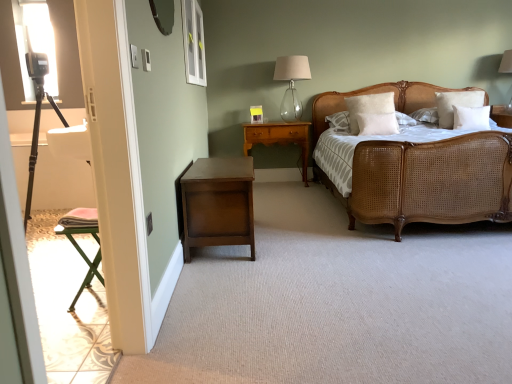
Question: Does white soft pillow at upper right, which is the fourth pillow from left to right, appear on the right side of woven cane bed at center?

Choices:
 (A) yes
 (B) no

Answer: (A)

Question: Can you confirm if white soft pillow at upper right, which is the fourth pillow from left to right, is thinner than woven cane bed at center?

Choices:
 (A) no
 (B) yes

Answer: (B)

Question: Does white soft pillow at upper right, the first pillow in the right-to-left sequence, have a greater width compared to woven cane bed at center?

Choices:
 (A) yes
 (B) no

Answer: (B)

Question: Does white soft pillow at upper right, the first pillow in the right-to-left sequence, come in front of woven cane bed at center?

Choices:
 (A) yes
 (B) no

Answer: (B)

Question: Is white soft pillow at upper right, the first pillow in the right-to-left sequence, taller than woven cane bed at center?

Choices:
 (A) yes
 (B) no

Answer: (B)

Question: Is white soft pillow at upper right, which is the fourth pillow from left to right, smaller than woven cane bed at center?

Choices:
 (A) yes
 (B) no

Answer: (A)

Question: Is dark wood nightstand at lower left, marked as the first nightstand in a front-to-back arrangement, with wooden nightstand at center, marked as the second nightstand in a front-to-back arrangement?

Choices:
 (A) yes
 (B) no

Answer: (B)

Question: Can you confirm if dark wood nightstand at lower left, the second nightstand positioned from the back, is bigger than wooden nightstand at center, the first nightstand positioned from the back?

Choices:
 (A) yes
 (B) no

Answer: (A)

Question: Can we say dark wood nightstand at lower left, marked as the first nightstand in a front-to-back arrangement, lies outside wooden nightstand at center, marked as the second nightstand in a front-to-back arrangement?

Choices:
 (A) yes
 (B) no

Answer: (A)

Question: Is dark wood nightstand at lower left, the second nightstand positioned from the back, smaller than wooden nightstand at center, the first nightstand positioned from the back?

Choices:
 (A) yes
 (B) no

Answer: (B)

Question: Does dark wood nightstand at lower left, the second nightstand positioned from the back, have a greater height compared to wooden nightstand at center, the first nightstand positioned from the back?

Choices:
 (A) yes
 (B) no

Answer: (B)

Question: From the image's perspective, is dark wood nightstand at lower left, the second nightstand positioned from the back, over wooden nightstand at center, marked as the second nightstand in a front-to-back arrangement?

Choices:
 (A) no
 (B) yes

Answer: (A)

Question: Does transparent glass window at upper center contain matte silver mirror at upper center?

Choices:
 (A) yes
 (B) no

Answer: (B)